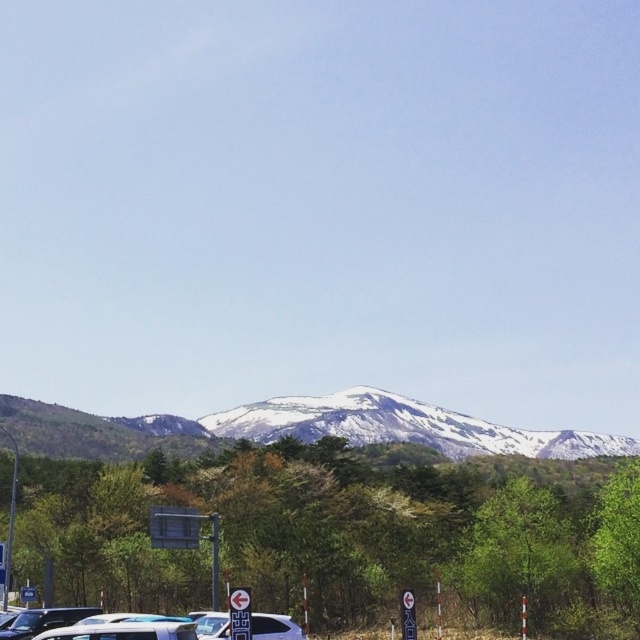
You are driving a car and want to know if the snowy white mountain at center is closer to you than the metallic silver car at lower center. Based on the scene, can you determine which is closer?

The snowy white mountain at center is further to the viewer than the metallic silver car at lower center, so the car is closer.

You are standing at the point with coordinates point (88,632) and want to walk towards the point with coordinates point (257,625). According to the scene, will you be moving towards the background or the foreground?

Since point (88,632) is closer to the camera than point (257,625), moving from point (88,632) to point (257,625) means you are moving towards the background.